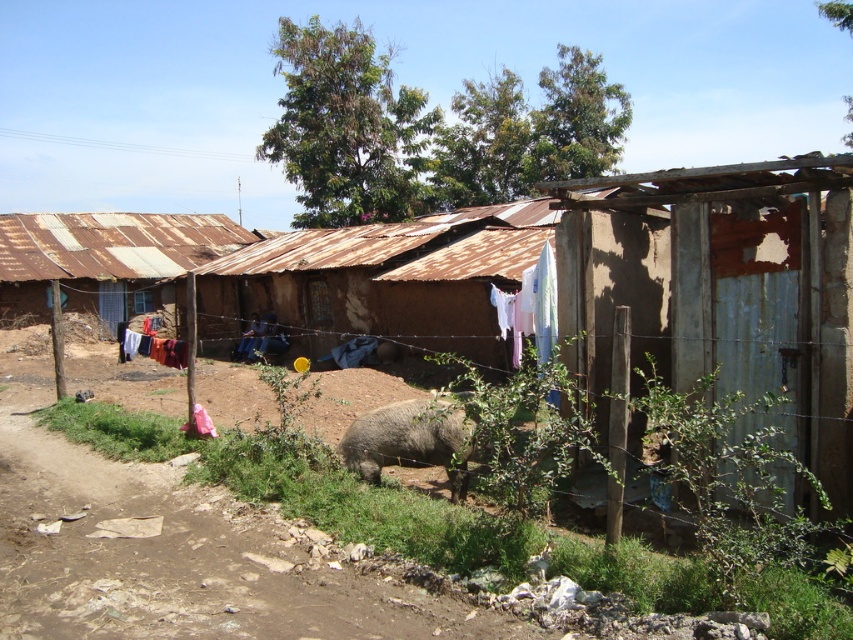
Does point (131, 230) come in front of point (175, 364)?

That is False.

Who is more distant from viewer, (0, 228) or (175, 344)?

Positioned behind is point (0, 228).

Where is `rusty metal hut at center`? The width and height of the screenshot is (853, 640). rusty metal hut at center is located at coordinates (102, 260).

Does gray matte pig at center lie behind white fabric at center?

No, gray matte pig at center is closer to the viewer.

Between gray matte pig at center and white fabric at center, which one is positioned lower?

gray matte pig at center

Which is in front, point (408, 416) or point (140, 353)?

Point (408, 416) is more forward.

Identify the location of gray matte pig at center. The height and width of the screenshot is (640, 853). (410, 440).

Does wire mesh at center appear on the right side of gray matte pig at center?

In fact, wire mesh at center is to the left of gray matte pig at center.

Measure the distance between wire mesh at center and camera.

wire mesh at center is 6.02 meters away from camera.

Find the location of a particular element. The image size is (853, 640). wire mesh at center is located at coordinates (120, 374).